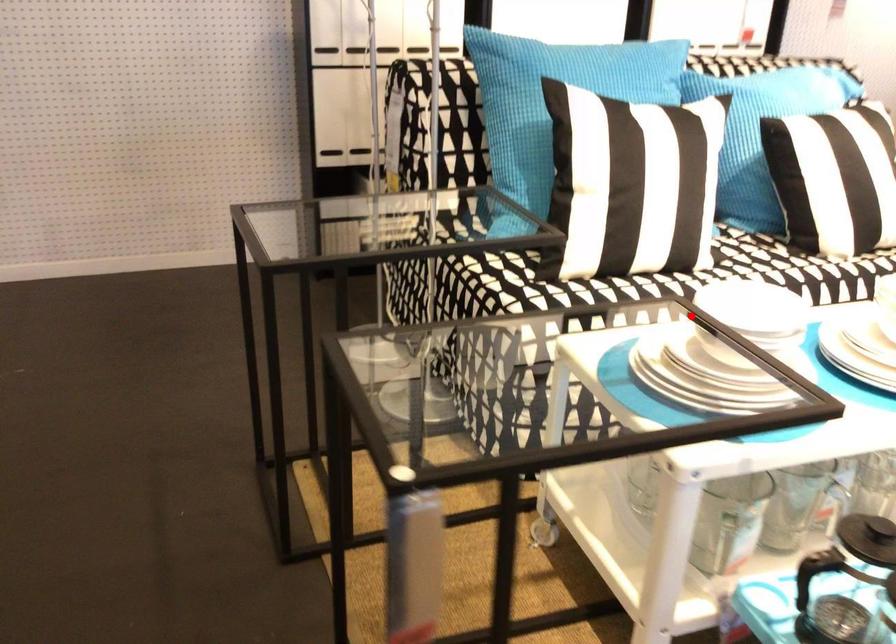
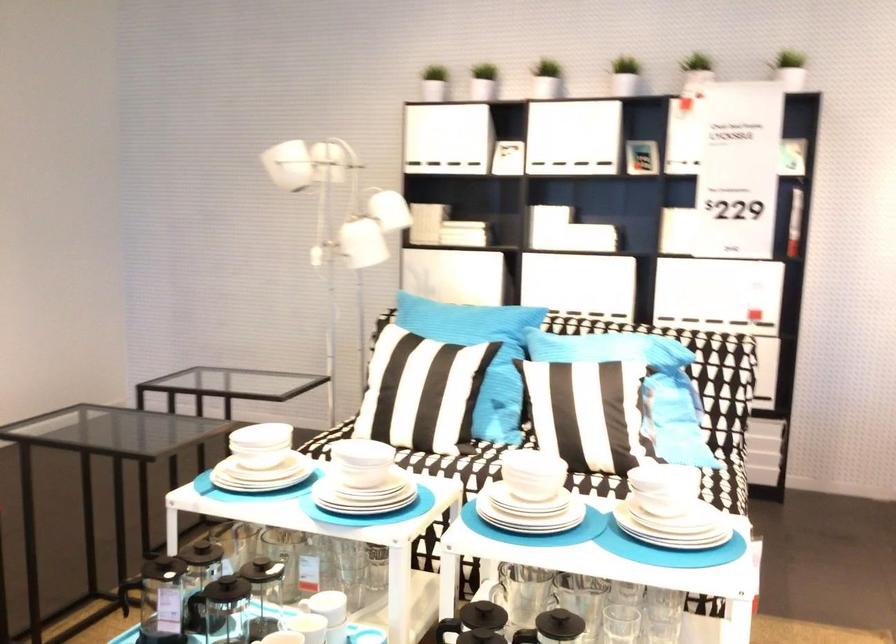
Where in the second image is the point corresponding to the highlighted location from the first image?

(261, 440)